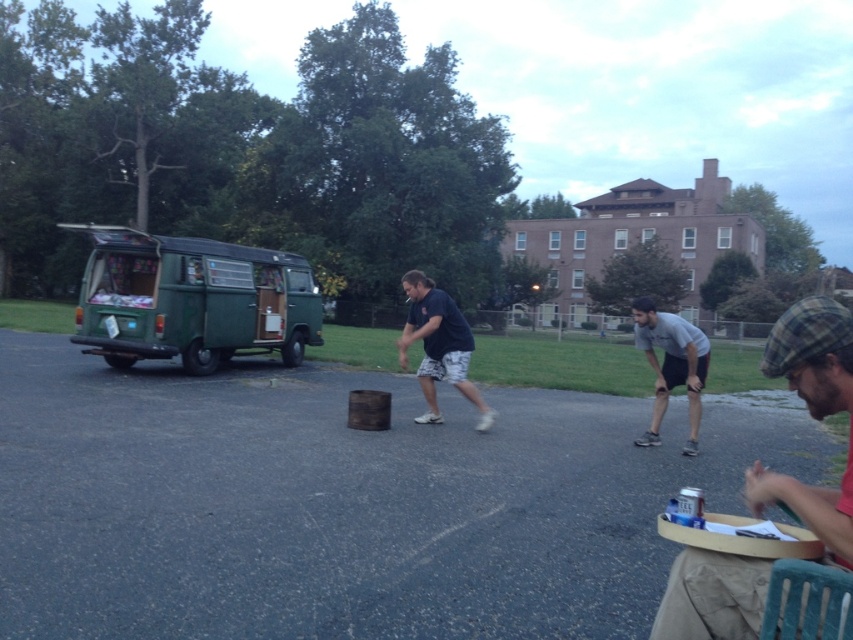
Can you confirm if dark blue t-shirt at center is taller than gray matte shirt at center?

Correct, dark blue t-shirt at center is much taller as gray matte shirt at center.

Is dark blue t-shirt at center to the left of gray matte shirt at center from the viewer's perspective?

Yes, dark blue t-shirt at center is to the left of gray matte shirt at center.

Which is in front, point (433, 330) or point (682, 349)?

Point (682, 349) is more forward.

At what (x,y) coordinates should I click in order to perform the action: click on dark blue t-shirt at center. Please return your answer as a coordinate pair (x, y). This screenshot has height=640, width=853. Looking at the image, I should click on (438, 346).

Is flannel hat at right in front of dark blue t-shirt at center?

Yes, flannel hat at right is in front of dark blue t-shirt at center.

Does flannel hat at right have a lesser height compared to dark blue t-shirt at center?

Indeed, flannel hat at right has a lesser height compared to dark blue t-shirt at center.

Locate an element on the screen. Image resolution: width=853 pixels, height=640 pixels. flannel hat at right is located at coordinates (811, 416).

Who is more forward, [149,349] or [756,499]?

Positioned in front is point [756,499].

Does green matte van at left appear over flannel hat at right?

Indeed, green matte van at left is positioned over flannel hat at right.

You are a GUI agent. You are given a task and a screenshot of the screen. Output one action in this format:
    pyautogui.click(x=<x>, y=<y>)
    Task: Click on the green matte van at left
    
    Given the screenshot: What is the action you would take?
    pyautogui.click(x=190, y=300)

The height and width of the screenshot is (640, 853). In order to click on green matte van at left in this screenshot , I will do `click(190, 300)`.